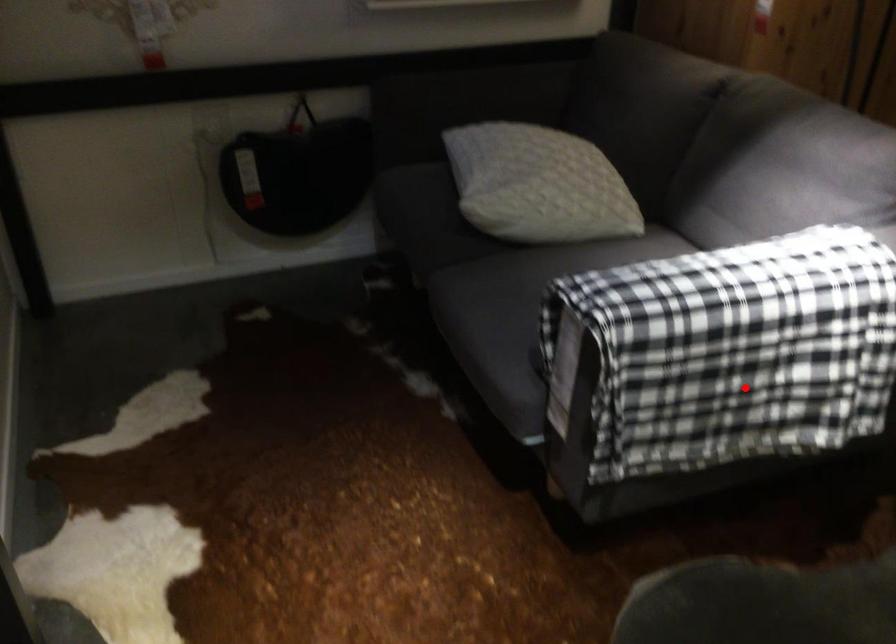
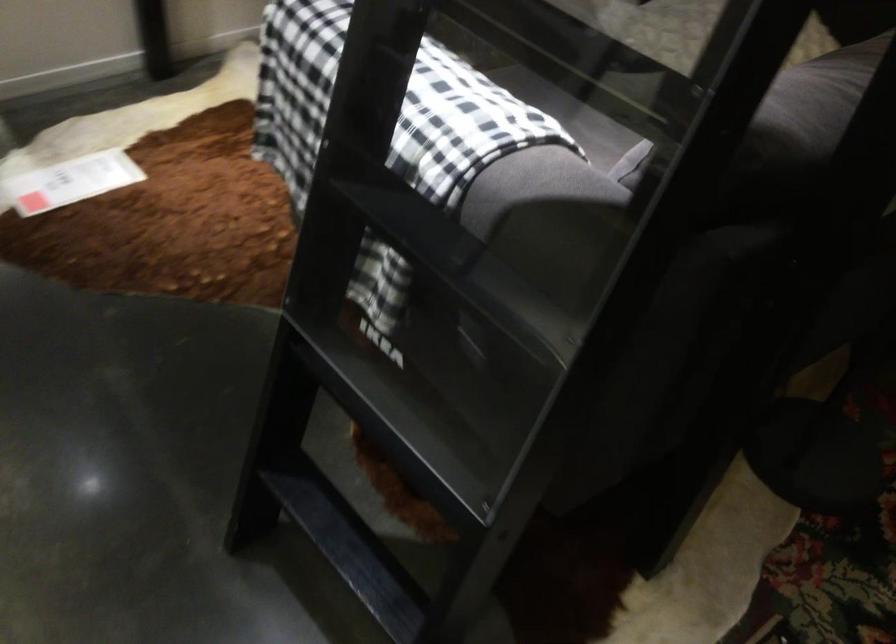
Question: I am providing you with two images of the same scene from different viewpoints. A red point is marked on the first image. At the location where the point appears in image 1, is it still visible in image 2?

Choices:
 (A) Yes
 (B) No

Answer: (B)